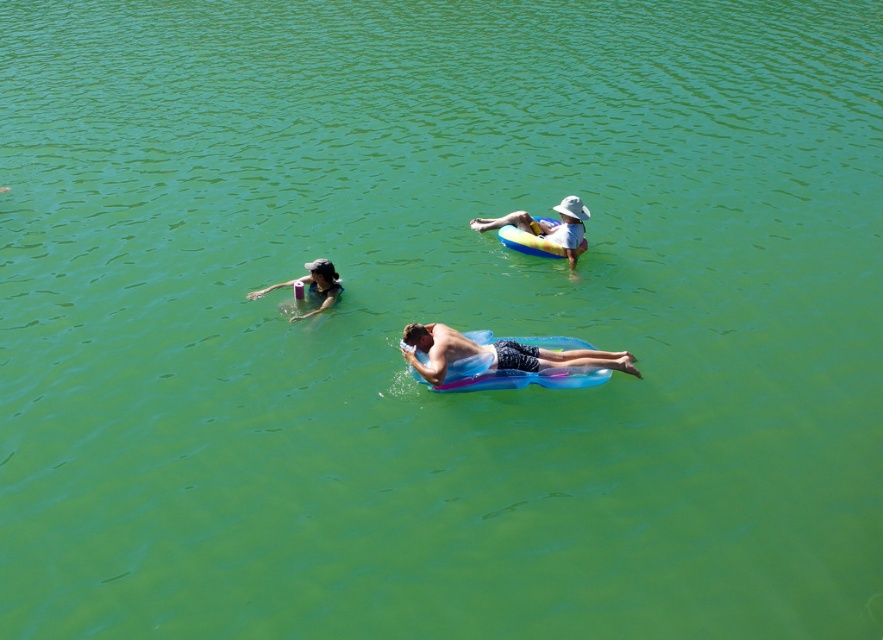
From the picture: You are standing on the dock and want to locate the translucent blue float at center. According to the coordinates provided, where would you look relative to the center of the image?

The translucent blue float at center is located at point (x=494, y=355), which is slightly to the right and above the center of the image.

You are standing at the point marked as point (580,209). You want to swim to the nearest person. How far will you have to swim?

The nearest person is 37.53 feet away from point (580,209).

You are standing at the edge of the lake and want to swim to the point that is closer to you. Which point should you aim for, point (459, 372) or point (315, 269)?

Point (459, 372) is in front of point (315, 269), so it is closer to you. You should aim for point (459, 372).